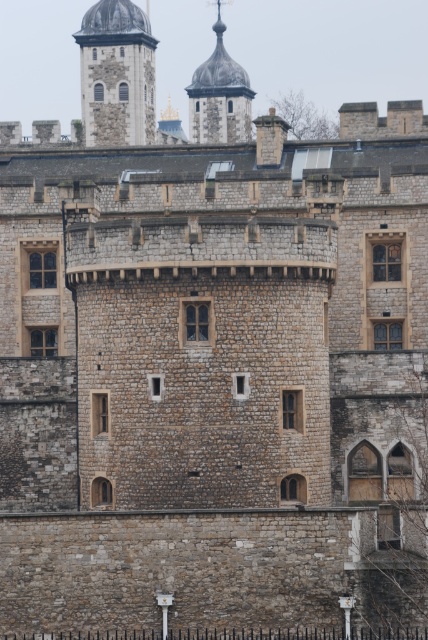
Can you confirm if stone dome at upper left is wider than smooth stone dome at upper center?

In fact, stone dome at upper left might be narrower than smooth stone dome at upper center.

Is stone dome at upper left to the right of smooth stone dome at upper center from the viewer's perspective?

No, stone dome at upper left is not to the right of smooth stone dome at upper center.

Which is behind, point (131, 81) or point (205, 83)?

The point (205, 83) is behind.

Find the location of a particular element. This screenshot has width=428, height=640. stone dome at upper left is located at coordinates (116, 74).